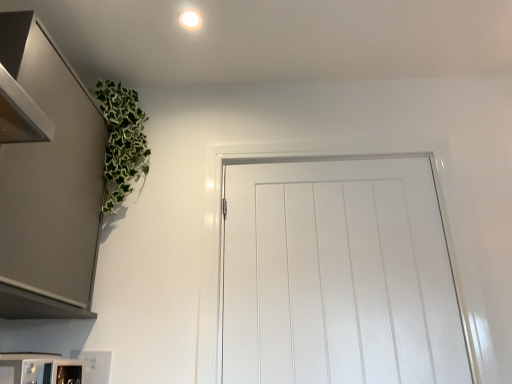
In order to face satin metallic cabinet at upper left, should I rotate leftwards or rightwards?

Turn left approximately 28.827 degrees to face it.

Locate an element on the screen. The height and width of the screenshot is (384, 512). white glossy door at center is located at coordinates (338, 275).

From their relative heights in the image, would you say white glossy light fixture at upper center is taller or shorter than white glossy microwave at lower left?

In the image, white glossy light fixture at upper center appears to be shorter than white glossy microwave at lower left.

Is white glossy light fixture at upper center facing away from white glossy microwave at lower left?

white glossy light fixture at upper center does not have its back to white glossy microwave at lower left.

Considering the relative sizes of white glossy light fixture at upper center and white glossy microwave at lower left in the image provided, is white glossy light fixture at upper center thinner than white glossy microwave at lower left?

In fact, white glossy light fixture at upper center might be wider than white glossy microwave at lower left.

From a real-world perspective, is white glossy light fixture at upper center physically above white glossy microwave at lower left?

Yes, from a real-world perspective, white glossy light fixture at upper center is on top of white glossy microwave at lower left.

Is white glossy light fixture at upper center to the left or to the right of white glossy door at center in the image?

Based on their positions, white glossy light fixture at upper center is located to the left of white glossy door at center.

Based on the photo, between white glossy light fixture at upper center and white glossy door at center, which one has larger width?

white glossy light fixture at upper center is wider.

How many degrees apart are the facing directions of white glossy light fixture at upper center and white glossy door at center?

The angular difference between white glossy light fixture at upper center and white glossy door at center is 90.4 degrees.

Based on their sizes in the image, would you say white glossy light fixture at upper center is bigger or smaller than white glossy door at center?

Clearly, white glossy light fixture at upper center is smaller in size than white glossy door at center.

What's the angular difference between satin metallic cabinet at upper left and white glossy door at center's facing directions?

They differ by 90.7 degrees in their facing directions.

Is satin metallic cabinet at upper left to the left of white glossy door at center from the viewer's perspective?

Yes.

Considering the sizes of objects satin metallic cabinet at upper left and white glossy door at center in the image provided, who is thinner, satin metallic cabinet at upper left or white glossy door at center?

Thinner between the two is white glossy door at center.

Is point (93, 360) more distant than point (197, 17)?

No, it is not.

In the scene shown: From a real-world perspective, which is physically above, white glossy microwave at lower left or white glossy light fixture at upper center?

white glossy light fixture at upper center, from a real-world perspective.

Is white glossy microwave at lower left next to white glossy light fixture at upper center?

No, white glossy microwave at lower left is not with white glossy light fixture at upper center.

Is white glossy microwave at lower left completely or partially outside of white glossy light fixture at upper center?

Yes.

Who is taller, white glossy microwave at lower left or white glossy door at center?

With more height is white glossy door at center.

Is white glossy microwave at lower left not near white glossy door at center?

Actually, white glossy microwave at lower left and white glossy door at center are a little close together.

From a real-world perspective, is white glossy microwave at lower left physically above white glossy door at center?

No, from a real-world perspective, white glossy microwave at lower left is not above white glossy door at center.

How far apart are white glossy door at center and satin metallic cabinet at upper left?

The distance of white glossy door at center from satin metallic cabinet at upper left is 31.43 inches.

From a real-world perspective, does white glossy door at center stand above satin metallic cabinet at upper left?

No, from a real-world perspective, white glossy door at center is not on top of satin metallic cabinet at upper left.

This screenshot has height=384, width=512. What are the coordinates of `door directly beneath the satin metallic cabinet at upper left (from a real-world perspective)` in the screenshot? It's located at tap(338, 275).

Considering the positions of objects white glossy door at center and satin metallic cabinet at upper left in the image provided, who is in front, white glossy door at center or satin metallic cabinet at upper left?

satin metallic cabinet at upper left is more forward.

Image resolution: width=512 pixels, height=384 pixels. Identify the location of lighting lying on the right of satin metallic cabinet at upper left. (190, 20).

Considering the positions of objects white glossy light fixture at upper center and satin metallic cabinet at upper left in the image provided, who is more to the right, white glossy light fixture at upper center or satin metallic cabinet at upper left?

white glossy light fixture at upper center.

Does point (185, 11) come farther from viewer compared to point (19, 290)?

Yes, it is.

Is satin metallic cabinet at upper left located within white glossy light fixture at upper center?

No, satin metallic cabinet at upper left is located outside of white glossy light fixture at upper center.

Locate an element on the screen. appliance below the white glossy light fixture at upper center (from the image's perspective) is located at coordinates (96, 364).

Find the location of a particular element. The width and height of the screenshot is (512, 384). door directly beneath the white glossy light fixture at upper center (from a real-world perspective) is located at coordinates (338, 275).

Looking at this image, considering their positions, is satin metallic cabinet at upper left positioned closer to white glossy microwave at lower left than white glossy door at center?

The object closer to white glossy microwave at lower left is satin metallic cabinet at upper left.

Which object lies further to the anchor point white glossy light fixture at upper center, white glossy microwave at lower left or white glossy door at center?

white glossy microwave at lower left is positioned further to the anchor white glossy light fixture at upper center.

Estimate the real-world distances between objects in this image. Which object is further from white glossy microwave at lower left, white glossy door at center or satin metallic cabinet at upper left?

Based on the image, white glossy door at center appears to be further to white glossy microwave at lower left.

Which object lies further to the anchor point satin metallic cabinet at upper left, white glossy light fixture at upper center or white glossy door at center?

The object further to satin metallic cabinet at upper left is white glossy door at center.

Looking at the image, which one is located further to white glossy door at center, white glossy microwave at lower left or satin metallic cabinet at upper left?

white glossy microwave at lower left is positioned further to the anchor white glossy door at center.

From the image, which object appears to be farther from white glossy door at center, satin metallic cabinet at upper left or white glossy microwave at lower left?

white glossy microwave at lower left is further to white glossy door at center.

In the scene shown: Considering their positions, is white glossy door at center positioned closer to satin metallic cabinet at upper left than white glossy light fixture at upper center?

Based on the image, white glossy light fixture at upper center appears to be nearer to satin metallic cabinet at upper left.

Considering their positions, is white glossy microwave at lower left positioned further to satin metallic cabinet at upper left than white glossy door at center?

Based on the image, white glossy door at center appears to be further to satin metallic cabinet at upper left.

I want to click on lighting situated between satin metallic cabinet at upper left and white glossy door at center from left to right, so click(x=190, y=20).

Where is `cabinetry between white glossy light fixture at upper center and white glossy microwave at lower left vertically`? The width and height of the screenshot is (512, 384). cabinetry between white glossy light fixture at upper center and white glossy microwave at lower left vertically is located at coordinates (49, 183).

The width and height of the screenshot is (512, 384). In order to click on door between white glossy light fixture at upper center and white glossy microwave at lower left in the up-down direction in this screenshot , I will do `click(338, 275)`.

You are a GUI agent. You are given a task and a screenshot of the screen. Output one action in this format:
    pyautogui.click(x=<x>, y=<y>)
    Task: Click on the appliance between satin metallic cabinet at upper left and white glossy door at center from left to right
    This screenshot has height=384, width=512.
    Given the screenshot: What is the action you would take?
    pyautogui.click(x=96, y=364)